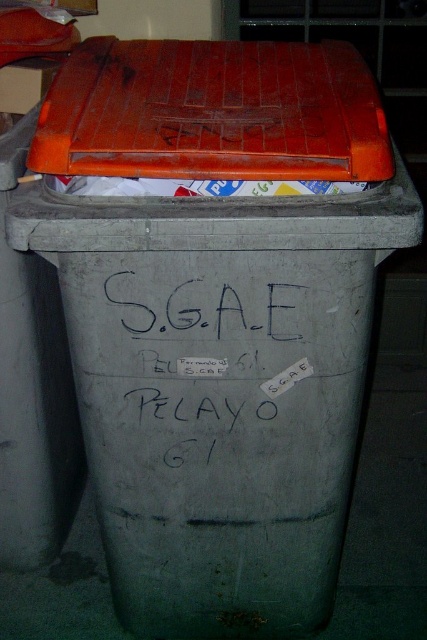
Question: In this image, where is orange plastic lid at upper center located relative to black matte writing at center?

Choices:
 (A) left
 (B) right

Answer: (A)

Question: Which point appears closest to the camera in this image?

Choices:
 (A) (78, 161)
 (B) (140, 296)

Answer: (A)

Question: Does orange plastic lid at upper center come in front of black matte writing at center?

Choices:
 (A) yes
 (B) no

Answer: (A)

Question: Is orange plastic lid at upper center positioned behind black matte writing at center?

Choices:
 (A) yes
 (B) no

Answer: (B)

Question: Which object appears closest to the camera in this image?

Choices:
 (A) orange plastic lid at upper center
 (B) black matte writing at center

Answer: (A)